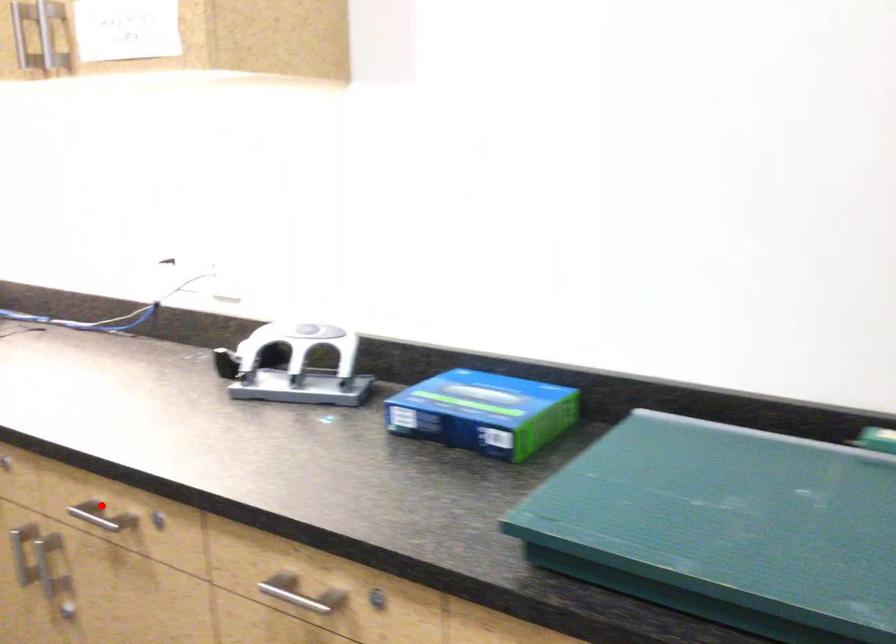
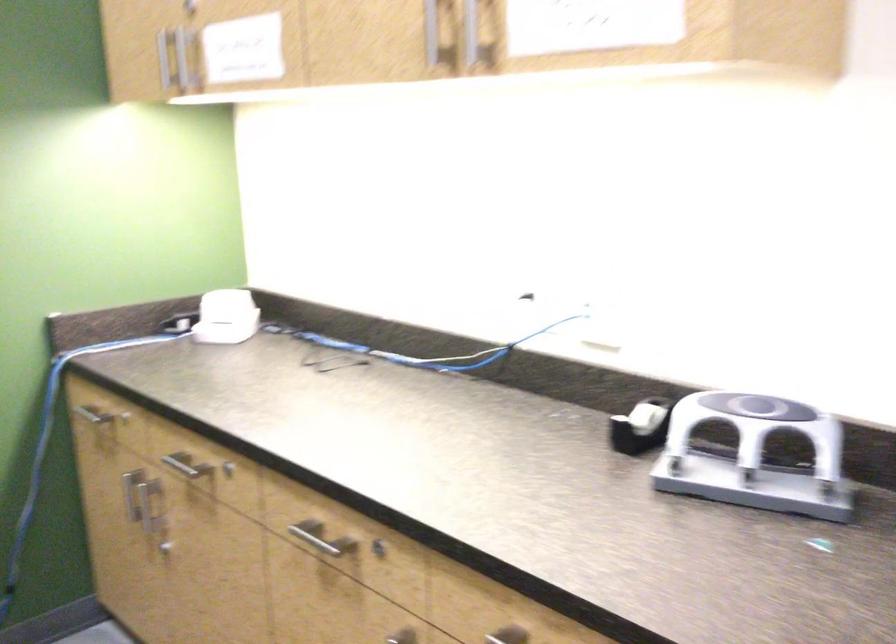
Question: I am providing you with two images of the same scene from different viewpoints. A red point is marked on the first image. Is the red point's position out of view in image 2?

Choices:
 (A) Yes
 (B) No

Answer: (B)